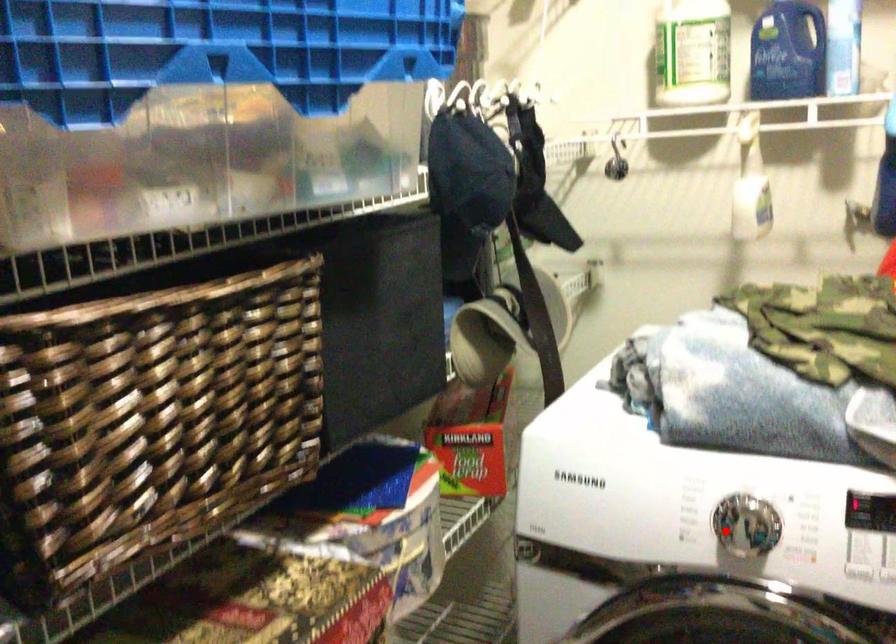
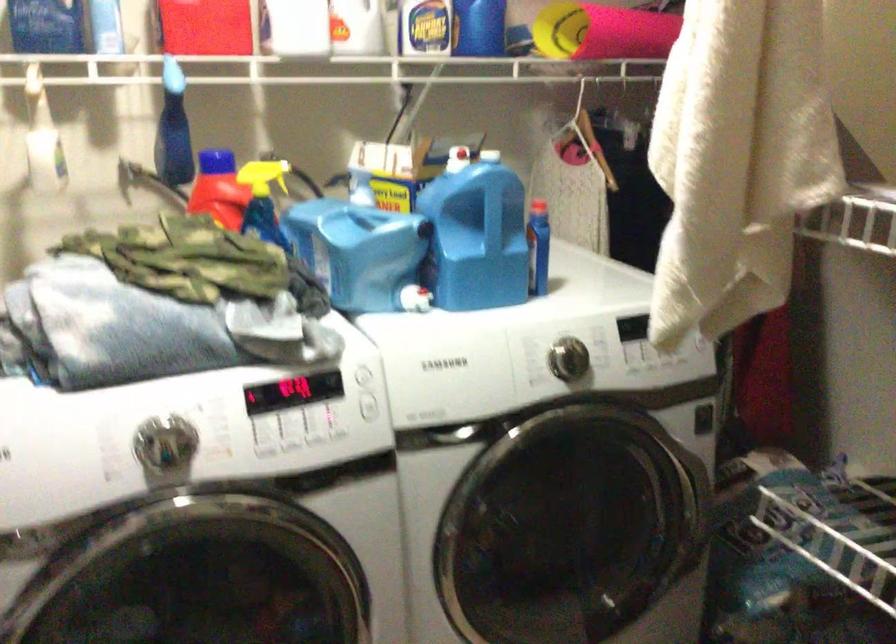
Question: I am providing you with two images of the same scene from different viewpoints. A red point is marked on the first image. At the location where the point appears in image 1, is it still visible in image 2?

Choices:
 (A) Yes
 (B) No

Answer: (A)